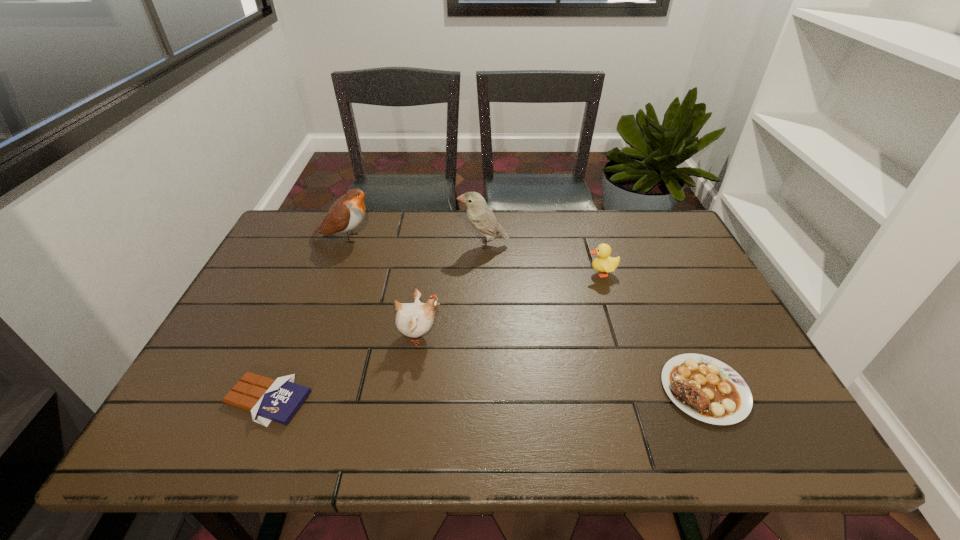
The width and height of the screenshot is (960, 540). In order to click on vacant region located at the face of the third object from right to left in this screenshot , I will do `click(422, 244)`.

Find the location of a particular element. This screenshot has height=540, width=960. free spot located 0.380m at the face of the third object from right to left is located at coordinates (336, 244).

Find the location of a particular element. Image resolution: width=960 pixels, height=540 pixels. blank space located at the face of the leftmost bird is located at coordinates (449, 238).

Locate an element on the screen. free space located at the beak of the fourth object from right to left is located at coordinates (475, 335).

Where is `vacant area situated 0.280m on the front-facing side of the duckling`? vacant area situated 0.280m on the front-facing side of the duckling is located at coordinates (489, 273).

At what (x,y) coordinates should I click in order to perform the action: click on vacant space located on the front-facing side of the duckling. Please return your answer as a coordinate pair (x, y). Looking at the image, I should click on (481, 273).

Locate an element on the screen. The width and height of the screenshot is (960, 540). free region located 0.370m on the front-facing side of the duckling is located at coordinates (457, 273).

Identify the location of vacant space located 0.270m on the back of the rightmost object. The width and height of the screenshot is (960, 540). (656, 280).

In order to click on free space located 0.120m on the back of the chocolate bar in this screenshot , I will do `click(295, 335)`.

The image size is (960, 540). Find the location of `steak at the near edge`. steak at the near edge is located at coordinates (705, 388).